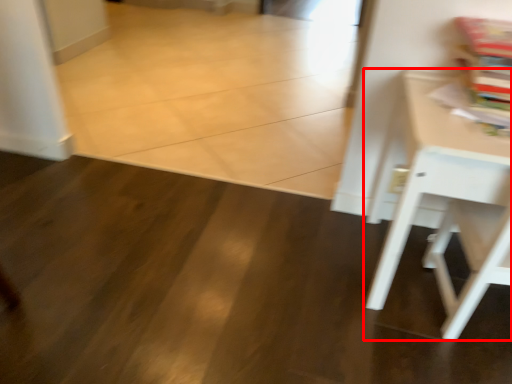
Question: From the image's perspective, where is table (annotated by the red box) located in relation to magazine in the image?

Choices:
 (A) below
 (B) above

Answer: (A)